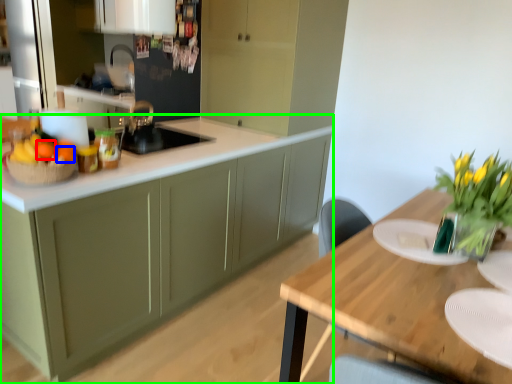
Question: Which object is positioned farthest from tangerine (highlighted by a red box)? Select from orange (highlighted by a blue box) and cabinetry (highlighted by a green box).

Choices:
 (A) orange
 (B) cabinetry

Answer: (B)